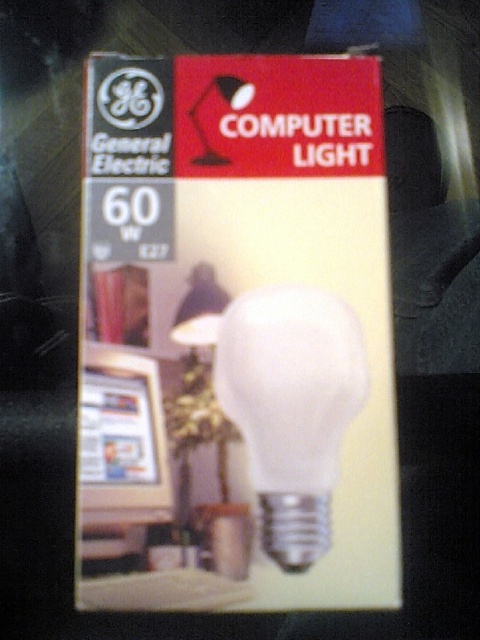
Question: Is white matte cardboard box at center thinner than white matte bulb at center?

Choices:
 (A) yes
 (B) no

Answer: (B)

Question: Which of the following is the closest to the observer?

Choices:
 (A) white matte bulb at center
 (B) white matte cardboard box at center

Answer: (B)

Question: Can you confirm if white matte cardboard box at center is smaller than white matte bulb at center?

Choices:
 (A) no
 (B) yes

Answer: (A)

Question: Is white matte cardboard box at center wider than white matte bulb at center?

Choices:
 (A) yes
 (B) no

Answer: (A)